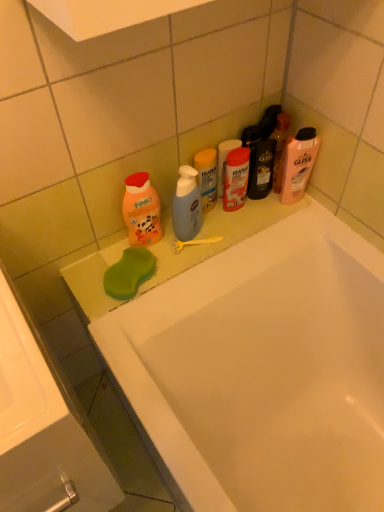
This screenshot has height=512, width=384. I want to click on orange matte baby soap at left, which is the first cleaning product in left-to-right order, so click(x=141, y=210).

What do you see at coordinates (207, 177) in the screenshot? The width and height of the screenshot is (384, 512). I see `translucent plastic bottle at center, the second cleaning product positioned from the right` at bounding box center [207, 177].

Image resolution: width=384 pixels, height=512 pixels. Describe the element at coordinates (262, 371) in the screenshot. I see `white glossy bathtub at upper center` at that location.

What are the coordinates of `white glossy bathtub at upper center` in the screenshot? It's located at (262, 371).

Where is `white glossy sink at lower left`? white glossy sink at lower left is located at coordinates (42, 431).

Are white glossy bathtub at upper center and pink matte shampoo at upper right, marked as the 3th cleaning product in a left-to-right arrangement, located far from each other?

They are positioned close to each other.

From a real-world perspective, between white glossy bathtub at upper center and pink matte shampoo at upper right, the 1th cleaning product positioned from the right, who is vertically lower?

white glossy bathtub at upper center, from a real-world perspective.

Can you confirm if white glossy bathtub at upper center is taller than pink matte shampoo at upper right, marked as the 3th cleaning product in a left-to-right arrangement?

Correct, white glossy bathtub at upper center is much taller as pink matte shampoo at upper right, marked as the 3th cleaning product in a left-to-right arrangement.

Considering the relative sizes of white glossy bathtub at upper center and pink matte shampoo at upper right, the 1th cleaning product positioned from the right, in the image provided, is white glossy bathtub at upper center smaller than pink matte shampoo at upper right, the 1th cleaning product positioned from the right,?

No, white glossy bathtub at upper center is not smaller than pink matte shampoo at upper right, the 1th cleaning product positioned from the right.

From the image's perspective, which is above, pink matte shampoo at upper right, the 1th cleaning product positioned from the right, or white glossy sink at lower left?

pink matte shampoo at upper right, the 1th cleaning product positioned from the right, is shown above in the image.

Starting from the white glossy sink at lower left, which cleaning product is the 2nd one behind? Please provide its 2D coordinates.

[(298, 164)]

From a real-world perspective, is pink matte shampoo at upper right, marked as the 3th cleaning product in a left-to-right arrangement, over white glossy sink at lower left?

Correct, in the physical world, pink matte shampoo at upper right, marked as the 3th cleaning product in a left-to-right arrangement, is higher than white glossy sink at lower left.

Does pink matte shampoo at upper right, the 1th cleaning product positioned from the right, have a lesser width compared to white glossy sink at lower left?

Indeed, pink matte shampoo at upper right, the 1th cleaning product positioned from the right, has a lesser width compared to white glossy sink at lower left.

Is there a large distance between white glossy sink at lower left and pink matte shampoo at upper right, the 1th cleaning product positioned from the right?

That's not correct — white glossy sink at lower left is a little close to pink matte shampoo at upper right, the 1th cleaning product positioned from the right.

Considering the relative sizes of white glossy sink at lower left and pink matte shampoo at upper right, the 1th cleaning product positioned from the right, in the image provided, is white glossy sink at lower left bigger than pink matte shampoo at upper right, the 1th cleaning product positioned from the right,?

Yes.

Does white glossy sink at lower left have a greater width compared to pink matte shampoo at upper right, the 1th cleaning product positioned from the right?

Correct, the width of white glossy sink at lower left exceeds that of pink matte shampoo at upper right, the 1th cleaning product positioned from the right.

Is translucent plastic bottle at center, the second cleaning product positioned from the right, at the back of white glossy sink at lower left?

No.

Locate an element on the screen. the 3rd cleaning product behind the white glossy sink at lower left, counting from the anchor's position is located at coordinates (207, 177).

Between white glossy sink at lower left and translucent plastic bottle at center, arranged as the 2th cleaning product when viewed from the left, which one has more height?

With more height is white glossy sink at lower left.

Is the depth of white glossy sink at lower left greater than that of translucent plastic bottle at center, arranged as the 2th cleaning product when viewed from the left?

No, white glossy sink at lower left is closer to the viewer.

Which object is more forward, orange matte baby soap at left, which is counted as the 3th cleaning product, starting from the right, or pink matte shampoo at upper right, marked as the 3th cleaning product in a left-to-right arrangement?

Positioned in front is orange matte baby soap at left, which is counted as the 3th cleaning product, starting from the right.

Which of these two, orange matte baby soap at left, which is the first cleaning product in left-to-right order, or pink matte shampoo at upper right, marked as the 3th cleaning product in a left-to-right arrangement, is smaller?

Smaller between the two is orange matte baby soap at left, which is the first cleaning product in left-to-right order.

Which cleaning product is the 2nd one when counting from the left side of the pink matte shampoo at upper right, marked as the 3th cleaning product in a left-to-right arrangement? Please provide its 2D coordinates.

[(141, 210)]

From a real-world perspective, which is physically above, pink matte shampoo at upper right, the 1th cleaning product positioned from the right, or translucent plastic bottle at center, the second cleaning product positioned from the right?

In real-world perspective, pink matte shampoo at upper right, the 1th cleaning product positioned from the right, is above.

Is pink matte shampoo at upper right, the 1th cleaning product positioned from the right, oriented away from translucent plastic bottle at center, the second cleaning product positioned from the right?

No, translucent plastic bottle at center, the second cleaning product positioned from the right, is not at the back of pink matte shampoo at upper right, the 1th cleaning product positioned from the right.

From a real-world perspective, starting from the pink matte shampoo at upper right, marked as the 3th cleaning product in a left-to-right arrangement, which cleaning product is the 2nd one below it? Please provide its 2D coordinates.

[(207, 177)]

Is pink matte shampoo at upper right, the 1th cleaning product positioned from the right, to the right of translucent plastic bottle at center, arranged as the 2th cleaning product when viewed from the left, from the viewer's perspective?

Yes.

What's the angular difference between orange matte baby soap at left, which is counted as the 3th cleaning product, starting from the right, and translucent plastic bottle at center, arranged as the 2th cleaning product when viewed from the left,'s facing directions?

The facing directions of orange matte baby soap at left, which is counted as the 3th cleaning product, starting from the right, and translucent plastic bottle at center, arranged as the 2th cleaning product when viewed from the left, are 0.000174 degrees apart.

Is orange matte baby soap at left, which is the first cleaning product in left-to-right order, far away from translucent plastic bottle at center, arranged as the 2th cleaning product when viewed from the left?

orange matte baby soap at left, which is the first cleaning product in left-to-right order, is near translucent plastic bottle at center, arranged as the 2th cleaning product when viewed from the left, not far away.

From a real-world perspective, is orange matte baby soap at left, which is counted as the 3th cleaning product, starting from the right, beneath translucent plastic bottle at center, arranged as the 2th cleaning product when viewed from the left?

Actually, orange matte baby soap at left, which is counted as the 3th cleaning product, starting from the right, is physically above translucent plastic bottle at center, arranged as the 2th cleaning product when viewed from the left, in the real world.

Which is closer to the camera, (157, 227) or (196, 168)?

Clearly, point (157, 227) is more distant from the camera than point (196, 168).

Where is `cleaning product on the right of the white glossy bathtub at upper center`? The width and height of the screenshot is (384, 512). cleaning product on the right of the white glossy bathtub at upper center is located at coordinates (x=298, y=164).

I want to click on the 3rd cleaning product above when counting from the white glossy sink at lower left (from the image's perspective), so click(x=298, y=164).

From the image, which object appears to be farther from translucent plastic bottle at center, arranged as the 2th cleaning product when viewed from the left, white glossy sink at lower left or white glossy bathtub at upper center?

The object further to translucent plastic bottle at center, arranged as the 2th cleaning product when viewed from the left, is white glossy sink at lower left.

From the image, which object appears to be farther from white glossy sink at lower left, translucent plastic bottle at center, arranged as the 2th cleaning product when viewed from the left, or white glossy bathtub at upper center?

The object further to white glossy sink at lower left is translucent plastic bottle at center, arranged as the 2th cleaning product when viewed from the left.

When comparing their distances from white glossy bathtub at upper center, does white glossy sink at lower left or pink matte shampoo at upper right, marked as the 3th cleaning product in a left-to-right arrangement, seem further?

Among the two, pink matte shampoo at upper right, marked as the 3th cleaning product in a left-to-right arrangement, is located further to white glossy bathtub at upper center.

When comparing their distances from white glossy bathtub at upper center, does pink matte shampoo at upper right, the 1th cleaning product positioned from the right, or white glossy sink at lower left seem further?

pink matte shampoo at upper right, the 1th cleaning product positioned from the right, is further to white glossy bathtub at upper center.

From the image, which object appears to be nearer to orange matte baby soap at left, which is counted as the 3th cleaning product, starting from the right, white glossy bathtub at upper center or translucent plastic bottle at center, arranged as the 2th cleaning product when viewed from the left?

translucent plastic bottle at center, arranged as the 2th cleaning product when viewed from the left, is closer to orange matte baby soap at left, which is counted as the 3th cleaning product, starting from the right.

Looking at the image, which one is located further to white glossy bathtub at upper center, white glossy sink at lower left or translucent plastic bottle at center, arranged as the 2th cleaning product when viewed from the left?

The object further to white glossy bathtub at upper center is translucent plastic bottle at center, arranged as the 2th cleaning product when viewed from the left.

From the image, which object appears to be farther from pink matte shampoo at upper right, the 1th cleaning product positioned from the right, white glossy sink at lower left or white glossy bathtub at upper center?

white glossy sink at lower left.

Based on their spatial positions, is pink matte shampoo at upper right, marked as the 3th cleaning product in a left-to-right arrangement, or translucent plastic bottle at center, arranged as the 2th cleaning product when viewed from the left, closer to white glossy sink at lower left?

translucent plastic bottle at center, arranged as the 2th cleaning product when viewed from the left.

This screenshot has height=512, width=384. I want to click on cleaning product between translucent plastic bottle at center, arranged as the 2th cleaning product when viewed from the left, and white glossy bathtub at upper center from top to bottom, so click(141, 210).

You are a GUI agent. You are given a task and a screenshot of the screen. Output one action in this format:
    pyautogui.click(x=<x>, y=<y>)
    Task: Click on the sink that lies between translucent plastic bottle at center, arranged as the 2th cleaning product when viewed from the left, and white glossy bathtub at upper center from top to bottom
    The height and width of the screenshot is (512, 384).
    Given the screenshot: What is the action you would take?
    pyautogui.click(x=42, y=431)

The width and height of the screenshot is (384, 512). Identify the location of sink between pink matte shampoo at upper right, marked as the 3th cleaning product in a left-to-right arrangement, and white glossy bathtub at upper center in the up-down direction. (42, 431).

In order to click on cleaning product between orange matte baby soap at left, which is the first cleaning product in left-to-right order, and pink matte shampoo at upper right, the 1th cleaning product positioned from the right, from left to right in this screenshot , I will do `click(207, 177)`.